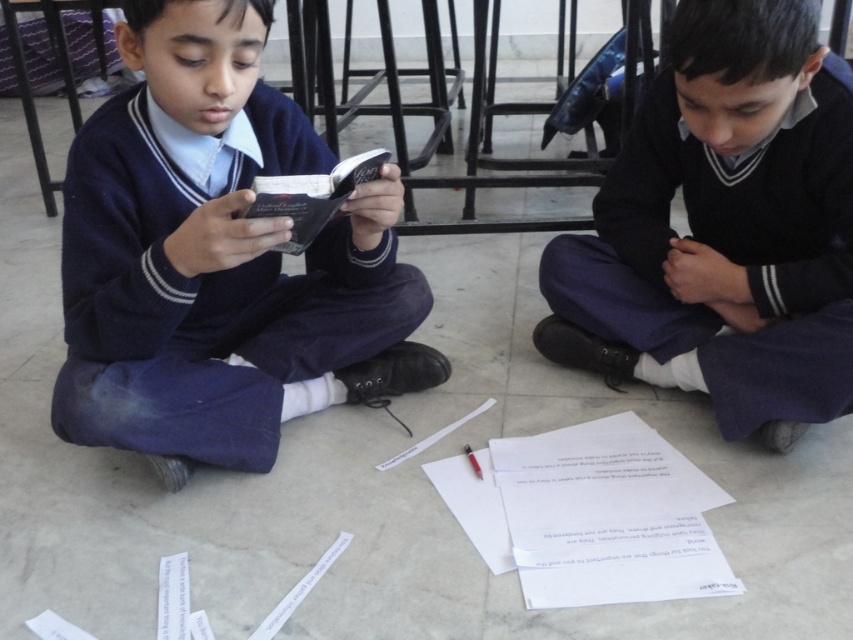
Question: Among these points, which one is nearest to the camera?

Choices:
 (A) (848, 188)
 (B) (70, 376)

Answer: (B)

Question: In this image, where is matte black book at center located relative to dark blue sweater at center?

Choices:
 (A) above
 (B) below

Answer: (B)

Question: Can you confirm if matte black book at center is wider than dark blue sweater at center?

Choices:
 (A) no
 (B) yes

Answer: (B)

Question: Among these points, which one is nearest to the camera?

Choices:
 (A) coord(195,99)
 (B) coord(688,333)

Answer: (A)

Question: Does matte black book at center appear on the left side of dark blue sweater at center?

Choices:
 (A) yes
 (B) no

Answer: (A)

Question: Which object appears closest to the camera in this image?

Choices:
 (A) matte black book at center
 (B) dark blue sweater at center

Answer: (A)